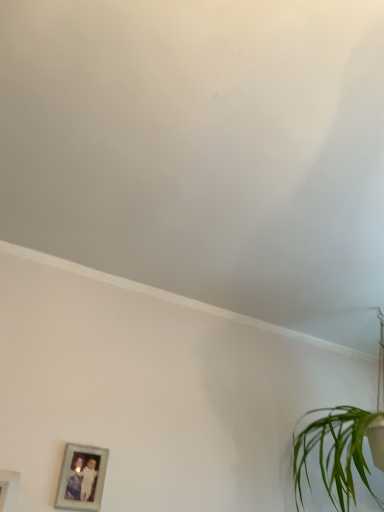
Question: Does white matte wall at upper center have a larger size compared to white matte picture frame at lower left, which is the first picture frame from front to back?

Choices:
 (A) yes
 (B) no

Answer: (A)

Question: Is white matte wall at upper center at the left side of white matte picture frame at lower left, the 2th picture frame viewed from the back?

Choices:
 (A) yes
 (B) no

Answer: (B)

Question: Can we say white matte wall at upper center lies outside white matte picture frame at lower left, which is the first picture frame from front to back?

Choices:
 (A) yes
 (B) no

Answer: (A)

Question: Is white matte wall at upper center not near white matte picture frame at lower left, the 1th picture frame from the left?

Choices:
 (A) no
 (B) yes

Answer: (A)

Question: Does white matte wall at upper center have a greater width compared to white matte picture frame at lower left, the 2th picture frame viewed from the back?

Choices:
 (A) no
 (B) yes

Answer: (B)

Question: Considering the positions of white matte picture frame at lower left, the 2th picture frame viewed from the back, and white matte wall at upper center in the image, is white matte picture frame at lower left, the 2th picture frame viewed from the back, taller or shorter than white matte wall at upper center?

Choices:
 (A) tall
 (B) short

Answer: (A)

Question: Considering the positions of white matte picture frame at lower left, which is counted as the 2th picture frame, starting from the right, and white matte wall at upper center in the image, is white matte picture frame at lower left, which is counted as the 2th picture frame, starting from the right, wider or thinner than white matte wall at upper center?

Choices:
 (A) wide
 (B) thin

Answer: (B)

Question: From a real-world perspective, is white matte picture frame at lower left, which is counted as the 2th picture frame, starting from the right, positioned above or below white matte wall at upper center?

Choices:
 (A) above
 (B) below

Answer: (B)

Question: Visually, is white matte picture frame at lower left, the 1th picture frame from the left, positioned to the left or to the right of white matte wall at upper center?

Choices:
 (A) right
 (B) left

Answer: (B)

Question: From their relative heights in the image, would you say green leafy plant at lower right is taller or shorter than white matte picture frame at lower left, the 2th picture frame viewed from the back?

Choices:
 (A) tall
 (B) short

Answer: (A)

Question: Considering the relative positions of green leafy plant at lower right and white matte picture frame at lower left, the 2th picture frame viewed from the back, in the image provided, is green leafy plant at lower right to the left or to the right of white matte picture frame at lower left, the 2th picture frame viewed from the back,?

Choices:
 (A) right
 (B) left

Answer: (A)

Question: Considering their positions, is green leafy plant at lower right located in front of or behind white matte picture frame at lower left, which is the first picture frame from front to back?

Choices:
 (A) behind
 (B) front

Answer: (A)

Question: Is green leafy plant at lower right spatially inside white matte picture frame at lower left, the 2th picture frame viewed from the back, or outside of it?

Choices:
 (A) inside
 (B) outside

Answer: (B)

Question: From a real-world perspective, is silver metallic photo frame at lower left, the second picture frame from the front, physically located above or below green leafy plant at lower right?

Choices:
 (A) below
 (B) above

Answer: (A)

Question: From the image's perspective, is silver metallic photo frame at lower left, the 2th picture frame in the left-to-right sequence, positioned above or below green leafy plant at lower right?

Choices:
 (A) above
 (B) below

Answer: (B)